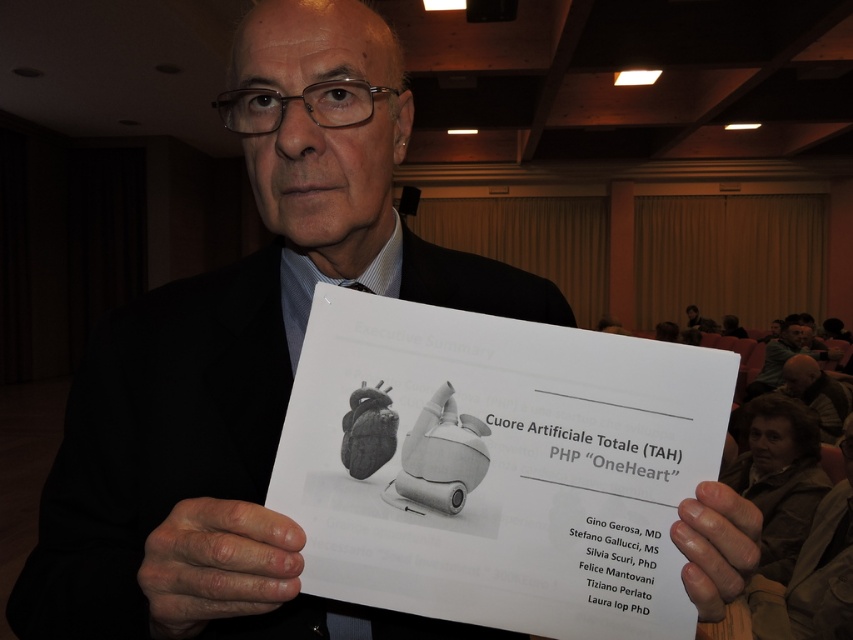
Is point (791, 364) farther from camera compared to point (793, 316)?

That is False.

Is gray matte heart at lower right to the left of gray hair at upper right from the viewer's perspective?

Indeed, gray matte heart at lower right is positioned on the left side of gray hair at upper right.

Does point (798, 368) come farther from viewer compared to point (775, 342)?

No, it is in front of (775, 342).

Locate an element on the screen. gray matte heart at lower right is located at coordinates (817, 394).

From the picture: Can you confirm if dry skin at center is taller than smooth skin at center?

Yes.

The height and width of the screenshot is (640, 853). Describe the element at coordinates (218, 564) in the screenshot. I see `dry skin at center` at that location.

You are a GUI agent. You are given a task and a screenshot of the screen. Output one action in this format:
    pyautogui.click(x=<x>, y=<y>)
    Task: Click on the dry skin at center
    The height and width of the screenshot is (640, 853).
    Given the screenshot: What is the action you would take?
    pyautogui.click(x=218, y=564)

Between dry skin at center and gray matte heart at lower right, which one is positioned lower?

gray matte heart at lower right is below.

Does dry skin at center have a lesser height compared to gray matte heart at lower right?

Yes.

Does point (238, 554) come in front of point (799, 364)?

That is True.

Locate an element on the screen. The height and width of the screenshot is (640, 853). dry skin at center is located at coordinates (218, 564).